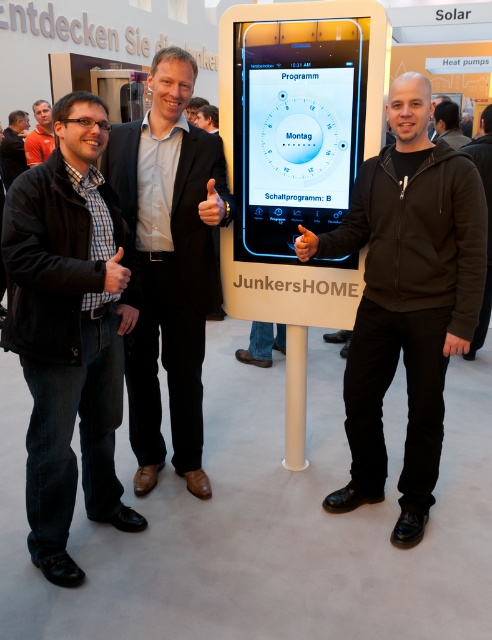
You are an attendee at the JunkersHOME exhibition and need to determine if the black matte jacket at left has a larger width compared to the black matte jacket at upper right. Based on the information provided, can you confirm this?

The black matte jacket at left might be wider than black matte jacket at upper right according to the description.